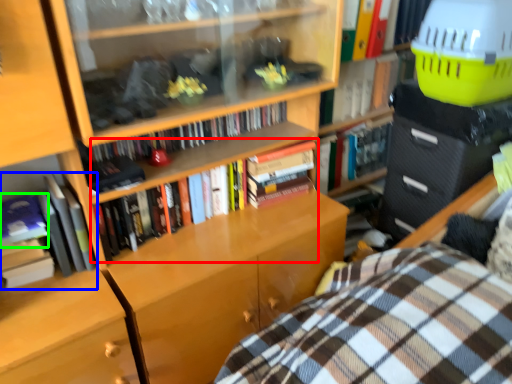
Question: Which object is positioned closest to book (highlighted by a red box)? Select from book (highlighted by a blue box) and book (highlighted by a green box).

Choices:
 (A) book
 (B) book

Answer: (A)